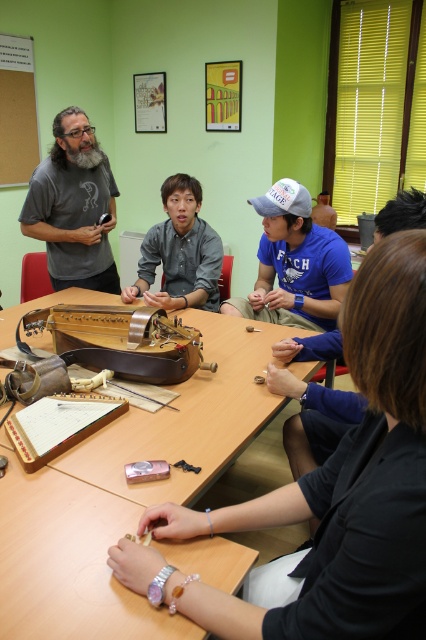
Question: Based on their relative distances, which object is nearer to the gray matte t-shirt at left?

Choices:
 (A) brown leather instrument at center
 (B) matte brown wooden instrument at center
 (C) wooden bulletin board at upper left

Answer: (A)

Question: Which point is farther to the camera?

Choices:
 (A) gray shirt at center
 (B) blue cotton cap at center
 (C) wooden table at center

Answer: (A)

Question: Is blue cotton cap at center to the right of wooden bulletin board at upper left from the viewer's perspective?

Choices:
 (A) yes
 (B) no

Answer: (A)

Question: In this image, where is blue cotton cap at center located relative to wooden bulletin board at upper left?

Choices:
 (A) right
 (B) left

Answer: (A)

Question: Among these points, which one is farthest from the camera?

Choices:
 (A) (161, 488)
 (B) (32, 58)
 (C) (213, 288)
 (D) (207, 612)

Answer: (B)

Question: Is gray matte t-shirt at left smaller than blue cotton cap at center?

Choices:
 (A) yes
 (B) no

Answer: (B)